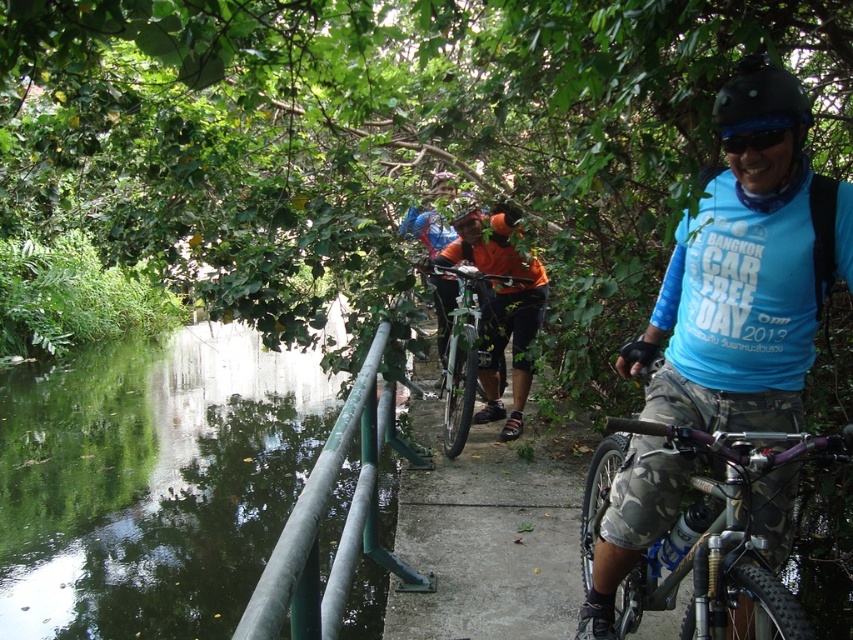
Can you confirm if blue matte shirt at center is thinner than black matte helmet at upper right?

In fact, blue matte shirt at center might be wider than black matte helmet at upper right.

Is blue matte shirt at center bigger than black matte helmet at upper right?

Indeed, blue matte shirt at center has a larger size compared to black matte helmet at upper right.

Is point (788, 413) positioned before point (787, 81)?

No, it is not.

Where is `blue matte shirt at center`? Image resolution: width=853 pixels, height=640 pixels. blue matte shirt at center is located at coordinates (747, 284).

Is camo fabric mountain bike at center below green painted metal railing at left?

No, camo fabric mountain bike at center is not below green painted metal railing at left.

Measure the distance between camo fabric mountain bike at center and camera.

camo fabric mountain bike at center is 5.36 feet away from camera.

What do you see at coordinates (700, 534) in the screenshot?
I see `camo fabric mountain bike at center` at bounding box center [700, 534].

Find the location of a particular element. The image size is (853, 640). camo fabric mountain bike at center is located at coordinates (700, 534).

Is point (22, 483) behind point (457, 340)?

Yes.

Is green smooth water at lower left taller than shiny silver bicycle at center?

Indeed, green smooth water at lower left has a greater height compared to shiny silver bicycle at center.

Does point (233, 404) come in front of point (479, 292)?

No.

You are a GUI agent. You are given a task and a screenshot of the screen. Output one action in this format:
    pyautogui.click(x=<x>, y=<y>)
    Task: Click on the green smooth water at lower left
    
    Given the screenshot: What is the action you would take?
    pyautogui.click(x=151, y=481)